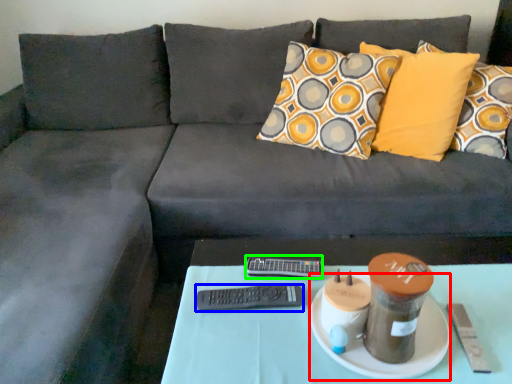
Question: Based on their relative distances, which object is nearer to plate (highlighted by a red box)? Choose from remote (highlighted by a blue box) and remote (highlighted by a green box).

Choices:
 (A) remote
 (B) remote

Answer: (A)